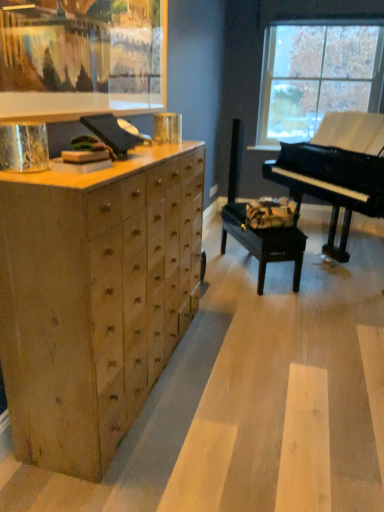
Find the location of a particular element. Image resolution: width=384 pixels, height=512 pixels. free spot in front of black wood music stool at center is located at coordinates (259, 307).